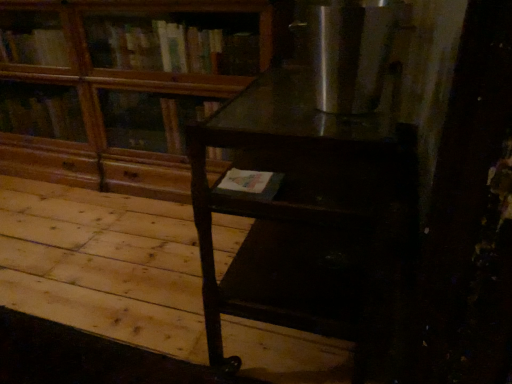
Question: Is dark wood table at center oriented away from stainless steel refrigerator at upper right?

Choices:
 (A) yes
 (B) no

Answer: (B)

Question: Is dark wood table at center at the left side of stainless steel refrigerator at upper right?

Choices:
 (A) no
 (B) yes

Answer: (B)

Question: Could you tell me if dark wood table at center is facing stainless steel refrigerator at upper right?

Choices:
 (A) no
 (B) yes

Answer: (A)

Question: From a real-world perspective, does dark wood table at center sit lower than stainless steel refrigerator at upper right?

Choices:
 (A) yes
 (B) no

Answer: (A)

Question: Is dark wood table at center smaller than stainless steel refrigerator at upper right?

Choices:
 (A) no
 (B) yes

Answer: (A)

Question: Does dark wood table at center have a lesser width compared to stainless steel refrigerator at upper right?

Choices:
 (A) no
 (B) yes

Answer: (A)

Question: Is dark wood table at center smaller than dark wood table at center?

Choices:
 (A) no
 (B) yes

Answer: (A)

Question: Is dark wood table at center behind dark wood table at center?

Choices:
 (A) no
 (B) yes

Answer: (B)

Question: Is dark wood table at center beside dark wood table at center?

Choices:
 (A) yes
 (B) no

Answer: (B)

Question: From a real-world perspective, is dark wood table at center positioned under dark wood table at center based on gravity?

Choices:
 (A) yes
 (B) no

Answer: (A)

Question: Does dark wood table at center turn towards dark wood table at center?

Choices:
 (A) no
 (B) yes

Answer: (A)

Question: Can you confirm if dark wood table at center is taller than dark wood table at center?

Choices:
 (A) no
 (B) yes

Answer: (A)

Question: Does dark wood table at center lie behind wooden at upper left?

Choices:
 (A) yes
 (B) no

Answer: (B)